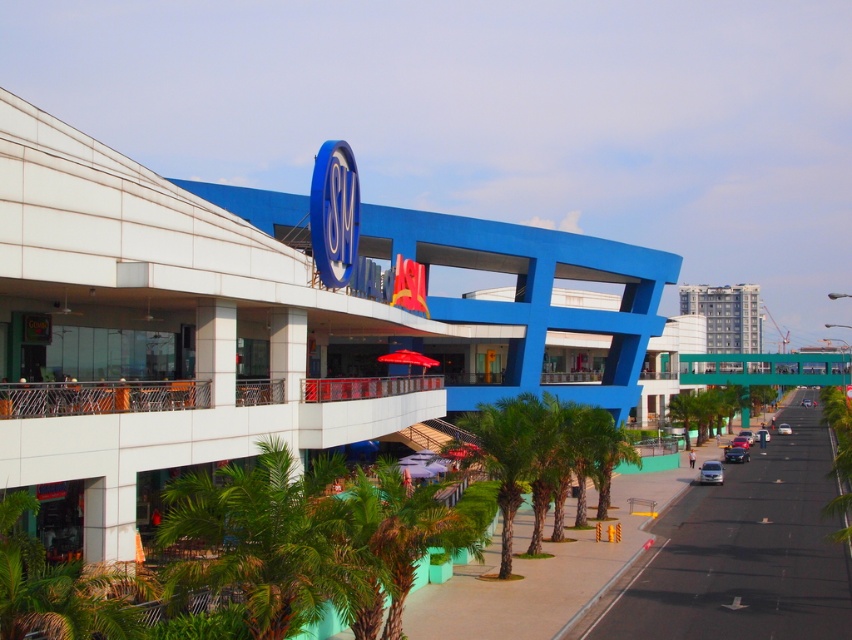
Does gray concrete building at upper right have a larger size compared to metallic silver sedan at center-right?

Yes.

How much distance is there between gray concrete building at upper right and metallic silver sedan at center-right?

gray concrete building at upper right is 123.18 meters away from metallic silver sedan at center-right.

Is point (718, 353) positioned after point (735, 448)?

Yes, point (718, 353) is behind point (735, 448).

Identify the location of gray concrete building at upper right. (726, 316).

Which is in front, point (714, 305) or point (784, 433)?

Positioned in front is point (784, 433).

Does gray concrete building at upper right appear over silver metallic sedan at center?

Indeed, gray concrete building at upper right is positioned over silver metallic sedan at center.

Measure the distance between point (x=746, y=296) and camera.

Point (x=746, y=296) is 216.02 meters from camera.

This screenshot has height=640, width=852. In order to click on gray concrete building at upper right in this screenshot , I will do `click(726, 316)`.

Who is shorter, green leafy palm tree at center or silver metallic sedan at center-right?

green leafy palm tree at center is shorter.

Locate an element on the screen. The image size is (852, 640). green leafy palm tree at center is located at coordinates (508, 456).

Find the location of a particular element. The width and height of the screenshot is (852, 640). green leafy palm tree at center is located at coordinates (508, 456).